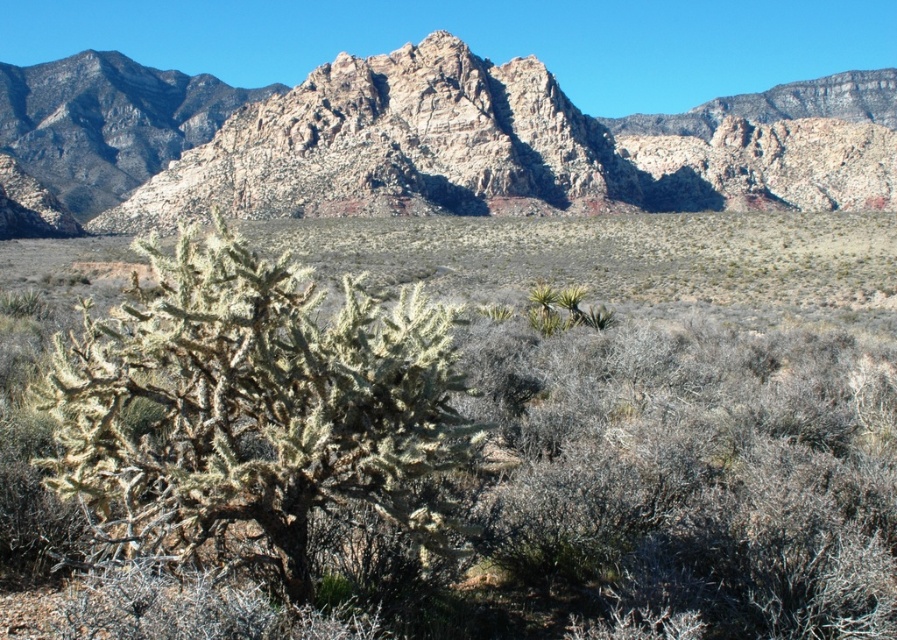
Question: Does rugged rock mountain range at upper center appear on the left side of green spiny bush at center?

Choices:
 (A) no
 (B) yes

Answer: (B)

Question: Can you confirm if rugged rock mountain range at upper center is bigger than green spiny bush at center?

Choices:
 (A) no
 (B) yes

Answer: (B)

Question: Which point is closer to the camera taking this photo?

Choices:
 (A) (260, 122)
 (B) (196, 509)

Answer: (B)

Question: From the image, what is the correct spatial relationship of rugged rock mountain range at upper center in relation to green spiny bush at center?

Choices:
 (A) above
 (B) below

Answer: (A)